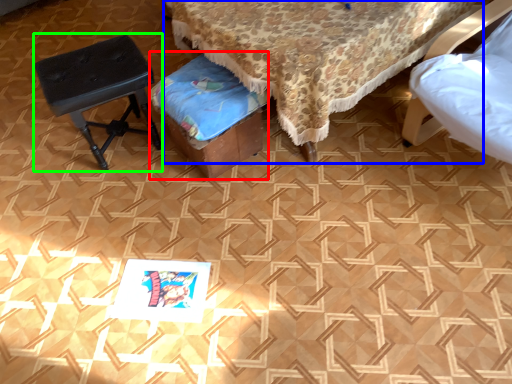
Question: Which is farther away from music stool (highlighted by a red box)? furniture (highlighted by a blue box) or stool (highlighted by a green box)?

Choices:
 (A) furniture
 (B) stool

Answer: (B)